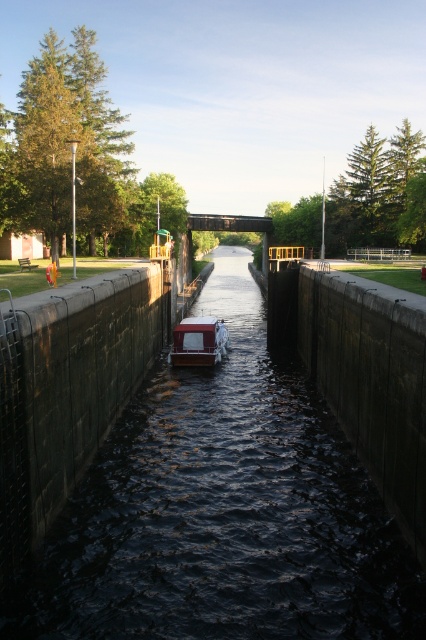
Question: Does dark concrete waterway at center lie in front of white glossy boat at center?

Choices:
 (A) yes
 (B) no

Answer: (A)

Question: Does dark concrete waterway at center appear under white glossy boat at center?

Choices:
 (A) yes
 (B) no

Answer: (A)

Question: Does dark concrete waterway at center have a larger size compared to white glossy boat at center?

Choices:
 (A) yes
 (B) no

Answer: (A)

Question: Which point is farther to the camera?

Choices:
 (A) white glossy boat at center
 (B) dark concrete waterway at center

Answer: (A)

Question: Among these points, which one is farthest from the camera?

Choices:
 (A) (302, 465)
 (B) (229, 339)

Answer: (B)